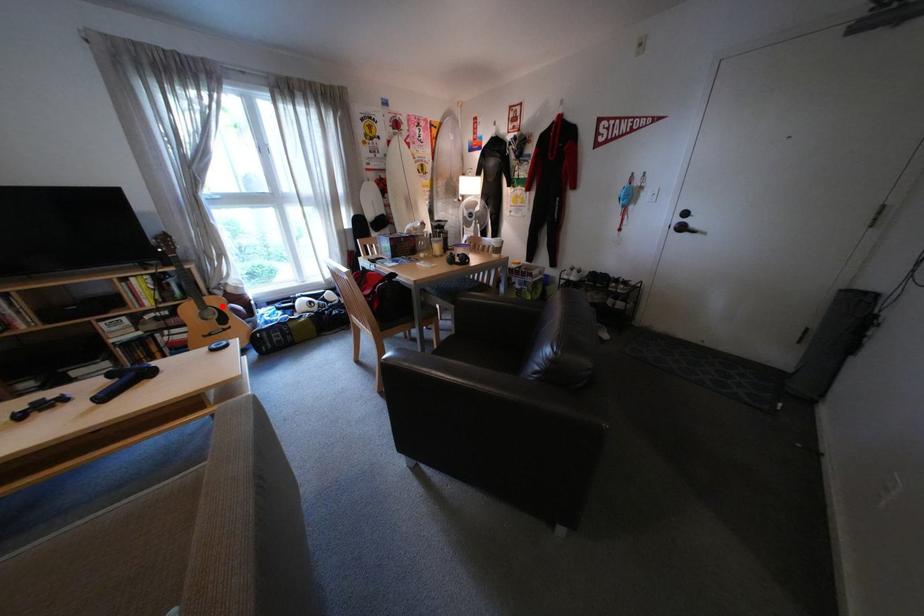
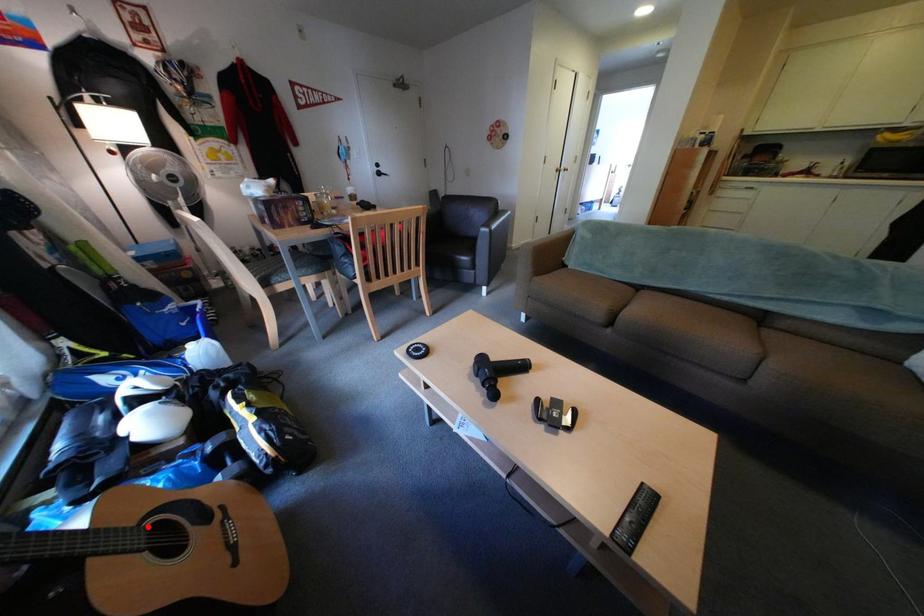
From the picture: I am providing you with two images of the same scene from different viewpoints. A red point is marked on the first image and another point is marked on the second image. Is the marked point in image1 the same physical position as the marked point in image2?

Yes